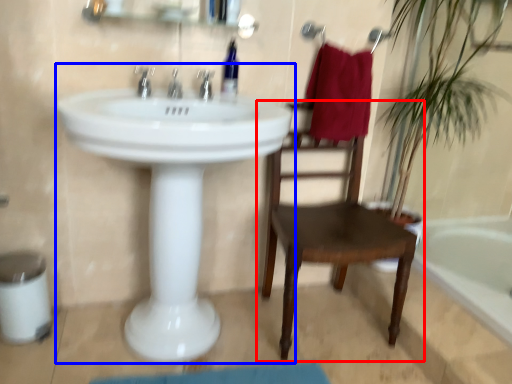
Question: Which of the following is the closest to the observer, chair (highlighted by a red box) or sink (highlighted by a blue box)?

Choices:
 (A) chair
 (B) sink

Answer: (B)